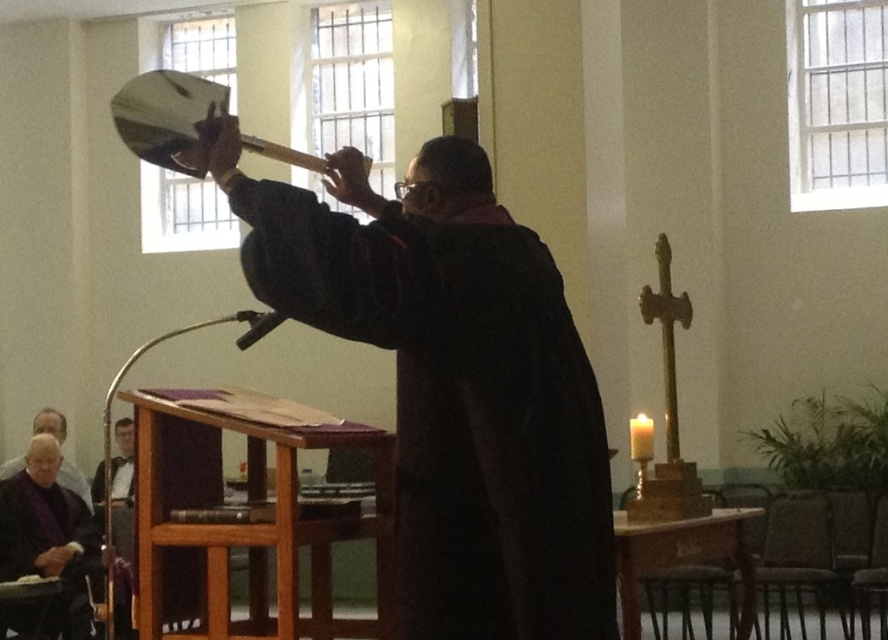
I want to click on black velvet robe at center, so click(461, 406).

You are a GUI agent. You are given a task and a screenshot of the screen. Output one action in this format:
    pyautogui.click(x=<x>, y=<y>)
    Task: Click on the black velvet robe at center
    The image size is (888, 640).
    Given the screenshot: What is the action you would take?
    pyautogui.click(x=461, y=406)

Who is taller, black velvet robe at center or brown wooden podium at lower center?

Standing taller between the two is black velvet robe at center.

Is black velvet robe at center bigger than brown wooden podium at lower center?

No.

The height and width of the screenshot is (640, 888). What do you see at coordinates (461, 406) in the screenshot?
I see `black velvet robe at center` at bounding box center [461, 406].

The image size is (888, 640). What are the coordinates of `black velvet robe at center` in the screenshot? It's located at (461, 406).

From the picture: Is brown wooden podium at lower center to the right of purple velvet robe at lower left from the viewer's perspective?

Correct, you'll find brown wooden podium at lower center to the right of purple velvet robe at lower left.

Does brown wooden podium at lower center have a smaller size compared to purple velvet robe at lower left?

Incorrect, brown wooden podium at lower center is not smaller in size than purple velvet robe at lower left.

Identify the location of brown wooden podium at lower center. Image resolution: width=888 pixels, height=640 pixels. (244, 528).